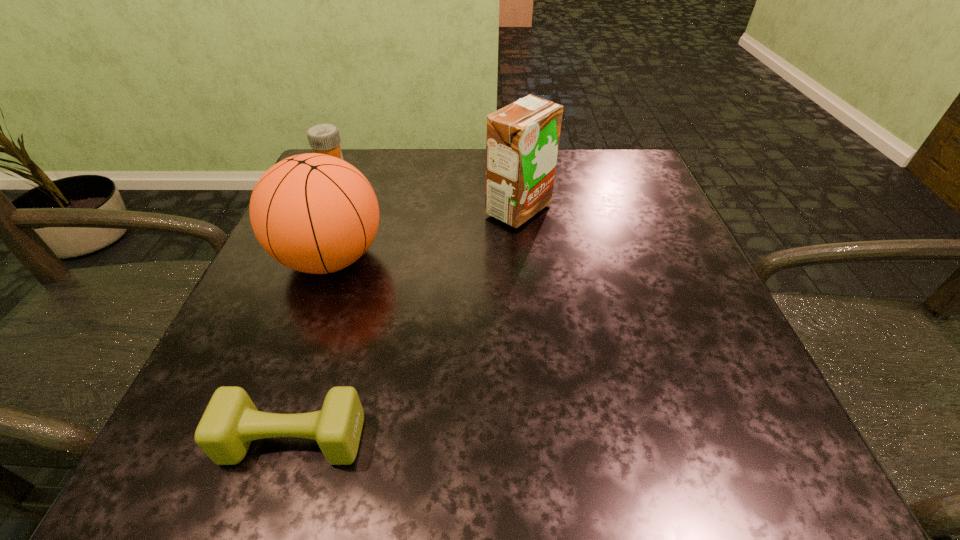
At what (x,y) coordinates should I click in order to perform the action: click on free space between the basketball and the carton. Please return your answer as a coordinate pair (x, y). Looking at the image, I should click on (424, 234).

Identify the location of unoccupied area between the carton and the medicine. (425, 191).

Locate an element on the screen. The width and height of the screenshot is (960, 540). free point between the rightmost object and the basketball is located at coordinates (424, 234).

Where is `vacant space in between the carton and the second shortest object`? The image size is (960, 540). vacant space in between the carton and the second shortest object is located at coordinates coord(425,191).

This screenshot has height=540, width=960. I want to click on the second closest object to the basketball, so click(x=522, y=139).

The image size is (960, 540). What are the coordinates of `object that is the closest to the basketball` in the screenshot? It's located at (324, 138).

Find the location of a particular element. This screenshot has height=540, width=960. vacant position in the image that satisfies the following two spatial constraints: 1. on the label side of the basketball; 2. on the left side of the farthest object is located at coordinates (293, 258).

I want to click on vacant space that satisfies the following two spatial constraints: 1. on the label side of the dumbbell; 2. on the left side of the medicine, so click(x=209, y=440).

Locate an element on the screen. The height and width of the screenshot is (540, 960). free region that satisfies the following two spatial constraints: 1. on the straw side of the carton; 2. on the front side of the shortest object is located at coordinates (543, 440).

I want to click on free space that satisfies the following two spatial constraints: 1. on the straw side of the carton; 2. on the front side of the nearest object, so click(x=543, y=440).